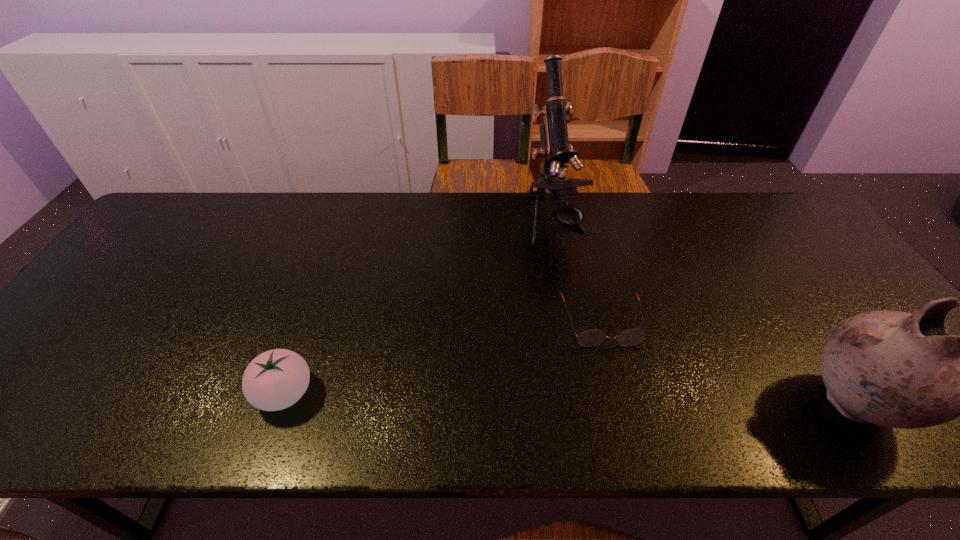
In the image, there is a desktop. At what (x,y) coordinates should I click in order to perform the action: click on vacant space at the left edge. Please return your answer as a coordinate pair (x, y). Looking at the image, I should click on (72, 353).

The height and width of the screenshot is (540, 960). I want to click on free space at the right edge of the desktop, so click(x=780, y=245).

Where is `free spot between the tomato and the second farthest object`? The image size is (960, 540). free spot between the tomato and the second farthest object is located at coordinates (443, 357).

This screenshot has width=960, height=540. Identify the location of blank region between the microscope and the spectacles. point(578,272).

Locate an element on the screen. vacant area that lies between the second farthest object and the leftmost object is located at coordinates (443, 357).

The height and width of the screenshot is (540, 960). I want to click on free space between the spectacles and the rightmost object, so (728, 362).

At what (x,y) coordinates should I click in order to perform the action: click on free area in between the rightmost object and the leftmost object. Please return your answer as a coordinate pair (x, y). The height and width of the screenshot is (540, 960). Looking at the image, I should click on (569, 398).

Where is `free space between the microscope and the third nearest object`? free space between the microscope and the third nearest object is located at coordinates (578, 272).

Where is `vacant space that is in between the farthest object and the pottery`? Image resolution: width=960 pixels, height=540 pixels. vacant space that is in between the farthest object and the pottery is located at coordinates (704, 313).

I want to click on free spot between the shortest object and the microscope, so click(x=578, y=272).